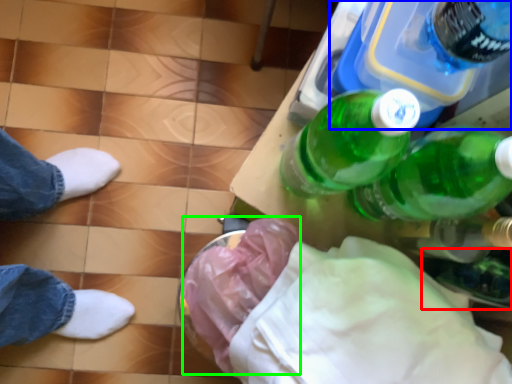
Question: Which is farther away from glass bottle (highlighted by a red box)? bottle (highlighted by a blue box) or material (highlighted by a green box)?

Choices:
 (A) bottle
 (B) material

Answer: (B)